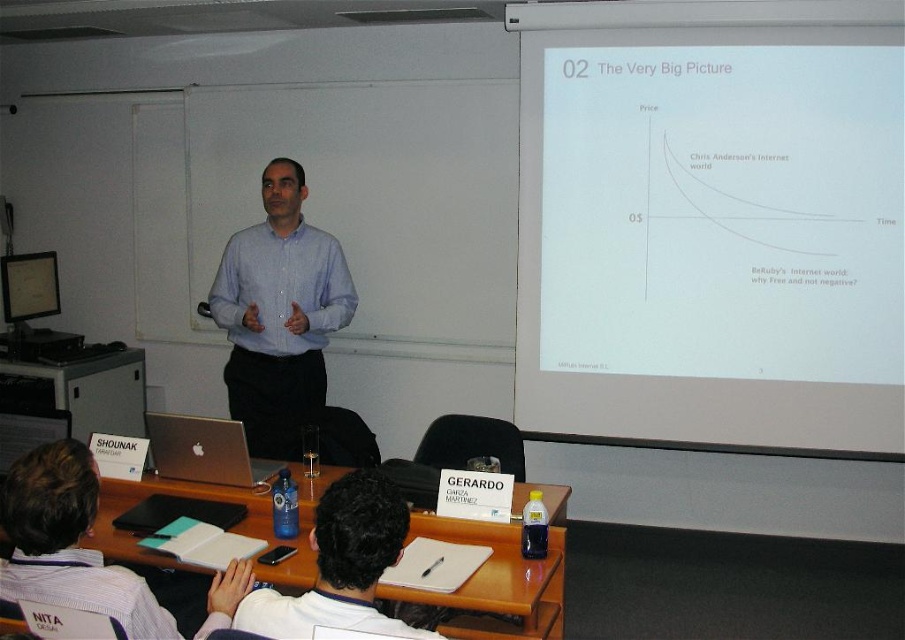
Question: Among these points, which one is farthest from the camera?

Choices:
 (A) (307, 604)
 (B) (43, 572)
 (C) (252, 280)

Answer: (C)

Question: Is dark brown hair at center wider than silver metallic laptop at center?

Choices:
 (A) yes
 (B) no

Answer: (A)

Question: Estimate the real-world distances between objects in this image. Which object is closer to the silver metallic laptop at center?

Choices:
 (A) blue shirt at center
 (B) dark brown hair at center
 (C) white shirt at lower left

Answer: (C)

Question: Is white shirt at lower left wider than silver metallic laptop at center?

Choices:
 (A) yes
 (B) no

Answer: (A)

Question: Considering the relative positions of blue shirt at center and white shirt at lower left in the image provided, where is blue shirt at center located with respect to white shirt at lower left?

Choices:
 (A) left
 (B) right

Answer: (A)

Question: Among these points, which one is nearest to the camera?

Choices:
 (A) (316, 358)
 (B) (355, 531)

Answer: (B)